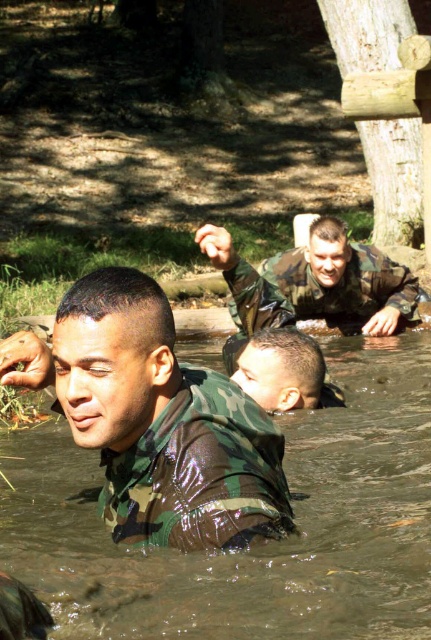
Is the position of camouflage fabric man at center less distant than that of camouflage uniform at center?

That is False.

Between point (316, 611) and point (15, 337), which one is positioned in front?

Positioned in front is point (316, 611).

Does point (131, 637) come behind point (131, 435)?

That is True.

In order to click on camouflage fabric man at center in this screenshot , I will do `click(252, 547)`.

Is camouflage fabric man at center wider than camouflage uniform at upper center?

Correct, the width of camouflage fabric man at center exceeds that of camouflage uniform at upper center.

Between point (278, 572) and point (334, 292), which one is positioned in front?

Point (278, 572) is in front.

Who is more forward, (162, 596) or (249, 298)?

Positioned in front is point (162, 596).

Find the location of a particular element. camouflage fabric man at center is located at coordinates (252, 547).

Is camouflage uniform at center below camouflage uniform at upper center?

Yes, camouflage uniform at center is below camouflage uniform at upper center.

Where is `camouflage uniform at center`? camouflage uniform at center is located at coordinates (156, 419).